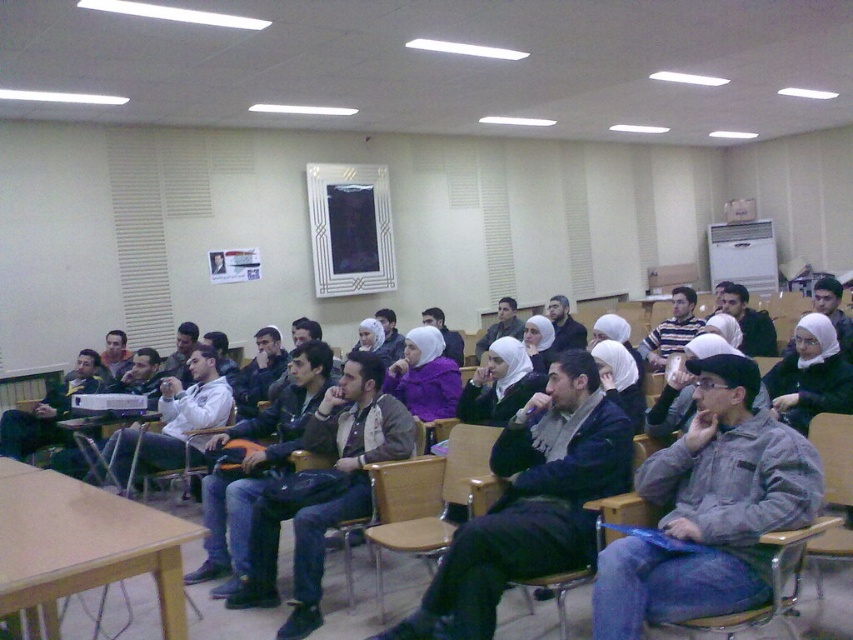
You are organizing a photo shoot in this classroom and need to position a 1.2m tall tripod between the gray fuzzy jacket at center and the wooden at center. Based on their heights, will the tripod be taller than both objects?

The gray fuzzy jacket at center is taller than wooden at center. However, since the gray fuzzy jacket at center is only mentioned to be taller than the wooden object, but no specific height is provided, we cannot definitively determine if the 1.2m tripod will be taller than both. More information about their exact heights is needed.

You are an attendee in the classroom and want to sit in the wooden chair at center. However, there is a dark gray jacket at center in your way. Is the jacket above or below the chair?

The dark gray jacket at center is located below the wooden chair at center, so the jacket is below the chair.

You are organizing a seating arrangement for a workshop and need to ensure that the gray fuzzy jacket at center and dark gray jacket at center are placed in a way that accommodates their sizes. Which jacket should be placed in a spot that requires less space?

The gray fuzzy jacket at center should be placed in the spot that requires less space because it occupies less space than the dark gray jacket at center according to the description.